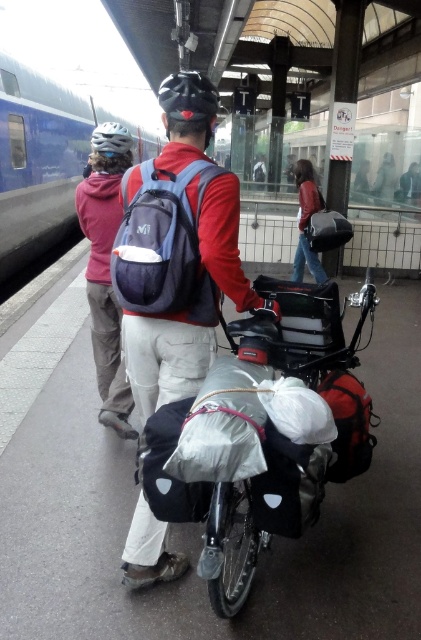
Question: Can you confirm if matte blue backpack at center is positioned below matte pink hoodie at upper left?

Choices:
 (A) yes
 (B) no

Answer: (A)

Question: Considering the relative positions of blue metallic train at left and leather jacket at upper center in the image provided, where is blue metallic train at left located with respect to leather jacket at upper center?

Choices:
 (A) below
 (B) above

Answer: (B)

Question: Estimate the real-world distances between objects in this image. Which object is closer to the matte blue backpack at center?

Choices:
 (A) blue metallic train at left
 (B) leather jacket at upper center
 (C) matte pink hoodie at upper left

Answer: (C)

Question: Estimate the real-world distances between objects in this image. Which object is closer to the matte blue backpack at center?

Choices:
 (A) matte pink hoodie at upper left
 (B) leather jacket at upper center
 (C) blue metallic train at left

Answer: (A)

Question: Is matte blue backpack at center to the left of matte pink hoodie at upper left from the viewer's perspective?

Choices:
 (A) yes
 (B) no

Answer: (B)

Question: Which point is closer to the camera taking this photo?

Choices:
 (A) (300, 243)
 (B) (202, 353)
 (C) (112, 216)
 (D) (72, 129)

Answer: (B)